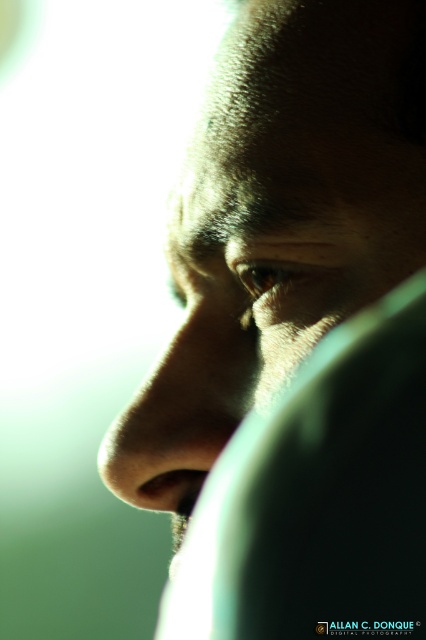
Question: Is matte skin face at center positioned before matte skin nose at center?

Choices:
 (A) yes
 (B) no

Answer: (A)

Question: Is matte skin face at center smaller than matte skin nose at center?

Choices:
 (A) yes
 (B) no

Answer: (B)

Question: Is matte skin face at center above matte skin nose at center?

Choices:
 (A) yes
 (B) no

Answer: (A)

Question: Which point is closer to the camera?

Choices:
 (A) matte skin nose at center
 (B) matte skin face at center

Answer: (B)